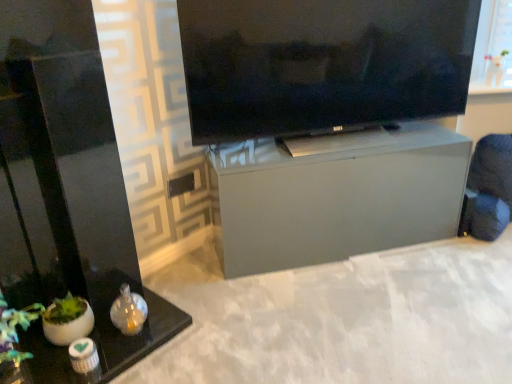
Find the location of a particular element. black glass table at lower left, acting as the first furniture starting from the left is located at coordinates (66, 190).

This screenshot has height=384, width=512. What do you see at coordinates (334, 195) in the screenshot?
I see `satin gray cabinet at center, the second furniture from the front` at bounding box center [334, 195].

At what (x,y) coordinates should I click in order to perform the action: click on matte black tv at upper center. Please return your answer as a coordinate pair (x, y). Looking at the image, I should click on (322, 63).

From a real-world perspective, which object stands above the other?

black glass table at lower left, the 2th furniture when ordered from right to left.

Is satin gray cabinet at center, the 1th furniture when ordered from back to front, to the left of black glass table at lower left, marked as the 2th furniture in a back-to-front arrangement, from the viewer's perspective?

No, satin gray cabinet at center, the 1th furniture when ordered from back to front, is not to the left of black glass table at lower left, marked as the 2th furniture in a back-to-front arrangement.

Is point (400, 132) behind point (46, 357)?

Yes, it is.

Consider the image. Is satin gray cabinet at center, which is the second furniture from left to right, oriented towards black glass table at lower left, the 2th furniture when ordered from right to left?

No, satin gray cabinet at center, which is the second furniture from left to right, does not turn towards black glass table at lower left, the 2th furniture when ordered from right to left.

What's the angular difference between matte black tv at upper center and black glass table at lower left, the 2th furniture when ordered from right to left,'s facing directions?

A: There is a 33.8-degree angle between the facing directions of matte black tv at upper center and black glass table at lower left, the 2th furniture when ordered from right to left.

Which is nearer, (216,25) or (66,81)?

Clearly, point (216,25) is more distant from the camera than point (66,81).

Is matte black tv at upper center to the left of black glass table at lower left, marked as the 2th furniture in a back-to-front arrangement, from the viewer's perspective?

No, matte black tv at upper center is not to the left of black glass table at lower left, marked as the 2th furniture in a back-to-front arrangement.

From a real-world perspective, is matte black tv at upper center located higher than black glass table at lower left, marked as the 2th furniture in a back-to-front arrangement?

Correct, in the physical world, matte black tv at upper center is higher than black glass table at lower left, marked as the 2th furniture in a back-to-front arrangement.

I want to click on television located in front of the satin gray cabinet at center, the second furniture from the front, so click(x=322, y=63).

Does satin gray cabinet at center, which is the second furniture from left to right, touch matte black tv at upper center?

No, satin gray cabinet at center, which is the second furniture from left to right, is not next to matte black tv at upper center.

What's the angular difference between satin gray cabinet at center, the 1th furniture when ordered from back to front, and matte black tv at upper center's facing directions?

satin gray cabinet at center, the 1th furniture when ordered from back to front, and matte black tv at upper center are facing 0.421 degrees away from each other.

Which of these two, satin gray cabinet at center, the 1th furniture when ordered from back to front, or matte black tv at upper center, stands shorter?

Standing shorter between the two is satin gray cabinet at center, the 1th furniture when ordered from back to front.

Would you say matte black tv at upper center is to the left or to the right of satin gray cabinet at center, the first furniture when ordered from right to left, in the picture?

From the image, it's evident that matte black tv at upper center is to the left of satin gray cabinet at center, the first furniture when ordered from right to left.

Does matte black tv at upper center have a lesser width compared to satin gray cabinet at center, the first furniture when ordered from right to left?

Indeed, matte black tv at upper center has a lesser width compared to satin gray cabinet at center, the first furniture when ordered from right to left.

Which is closer, [419,105] or [389,189]?

The point [389,189] is closer.

Between matte black tv at upper center and satin gray cabinet at center, which is the second furniture from left to right, which one has less height?

satin gray cabinet at center, which is the second furniture from left to right, is shorter.

Considering the sizes of objects black glass table at lower left, arranged as the first furniture when viewed from the front, and matte black tv at upper center in the image provided, who is taller, black glass table at lower left, arranged as the first furniture when viewed from the front, or matte black tv at upper center?

Standing taller between the two is black glass table at lower left, arranged as the first furniture when viewed from the front.

From a real-world perspective, starting from the matte black tv at upper center, which furniture is the 1st one below it? Please provide its 2D coordinates.

[(66, 190)]

From the image's perspective, who appears lower, black glass table at lower left, arranged as the first furniture when viewed from the front, or matte black tv at upper center?

black glass table at lower left, arranged as the first furniture when viewed from the front, appears lower in the image.

Consider the image. Who is bigger, black glass table at lower left, acting as the first furniture starting from the left, or matte black tv at upper center?

With larger size is black glass table at lower left, acting as the first furniture starting from the left.

Would you say black glass table at lower left, acting as the first furniture starting from the left, is inside or outside satin gray cabinet at center, the 1th furniture when ordered from back to front?

black glass table at lower left, acting as the first furniture starting from the left, is not enclosed by satin gray cabinet at center, the 1th furniture when ordered from back to front.

Could you tell me if black glass table at lower left, marked as the 2th furniture in a back-to-front arrangement, is turned towards satin gray cabinet at center, the first furniture when ordered from right to left?

No, black glass table at lower left, marked as the 2th furniture in a back-to-front arrangement, is not facing towards satin gray cabinet at center, the first furniture when ordered from right to left.

Would you consider black glass table at lower left, arranged as the first furniture when viewed from the front, to be distant from satin gray cabinet at center, the second furniture from the front?

They are positioned close to each other.

Where is `furniture on the right of black glass table at lower left, marked as the 2th furniture in a back-to-front arrangement`? The height and width of the screenshot is (384, 512). furniture on the right of black glass table at lower left, marked as the 2th furniture in a back-to-front arrangement is located at coordinates (334, 195).

You are a GUI agent. You are given a task and a screenshot of the screen. Output one action in this format:
    pyautogui.click(x=<x>, y=<y>)
    Task: Click on the furniture in front of the matte black tv at upper center
    
    Given the screenshot: What is the action you would take?
    pos(66,190)

Which object lies nearer to the anchor point black glass table at lower left, acting as the first furniture starting from the left, satin gray cabinet at center, the second furniture from the front, or matte black tv at upper center?

Among the two, satin gray cabinet at center, the second furniture from the front, is located nearer to black glass table at lower left, acting as the first furniture starting from the left.

Looking at the image, which one is located closer to matte black tv at upper center, black glass table at lower left, acting as the first furniture starting from the left, or satin gray cabinet at center, the second furniture from the front?

The object closer to matte black tv at upper center is satin gray cabinet at center, the second furniture from the front.

Estimate the real-world distances between objects in this image. Which object is further from matte black tv at upper center, satin gray cabinet at center, the first furniture when ordered from right to left, or black glass table at lower left, acting as the first furniture starting from the left?

black glass table at lower left, acting as the first furniture starting from the left, lies further to matte black tv at upper center than the other object.

Which object lies further to the anchor point satin gray cabinet at center, which is the second furniture from left to right, black glass table at lower left, marked as the 2th furniture in a back-to-front arrangement, or matte black tv at upper center?

black glass table at lower left, marked as the 2th furniture in a back-to-front arrangement, is positioned further to the anchor satin gray cabinet at center, which is the second furniture from left to right.

Which object lies further to the anchor point satin gray cabinet at center, the first furniture when ordered from right to left, matte black tv at upper center or black glass table at lower left, marked as the 2th furniture in a back-to-front arrangement?

Among the two, black glass table at lower left, marked as the 2th furniture in a back-to-front arrangement, is located further to satin gray cabinet at center, the first furniture when ordered from right to left.

Estimate the real-world distances between objects in this image. Which object is further from black glass table at lower left, acting as the first furniture starting from the left, matte black tv at upper center or satin gray cabinet at center, the 1th furniture when ordered from back to front?

Based on the image, matte black tv at upper center appears to be further to black glass table at lower left, acting as the first furniture starting from the left.

I want to click on television between black glass table at lower left, marked as the 2th furniture in a back-to-front arrangement, and satin gray cabinet at center, which is the second furniture from left to right, from left to right, so click(322, 63).